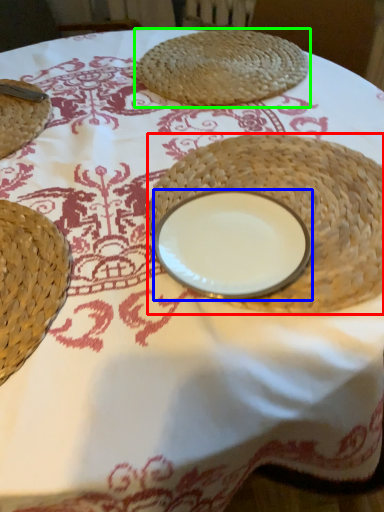
Question: Considering the real-world distances, which object is farthest from straw hat (highlighted by a red box)? tableware (highlighted by a blue box) or food (highlighted by a green box)?

Choices:
 (A) tableware
 (B) food

Answer: (B)